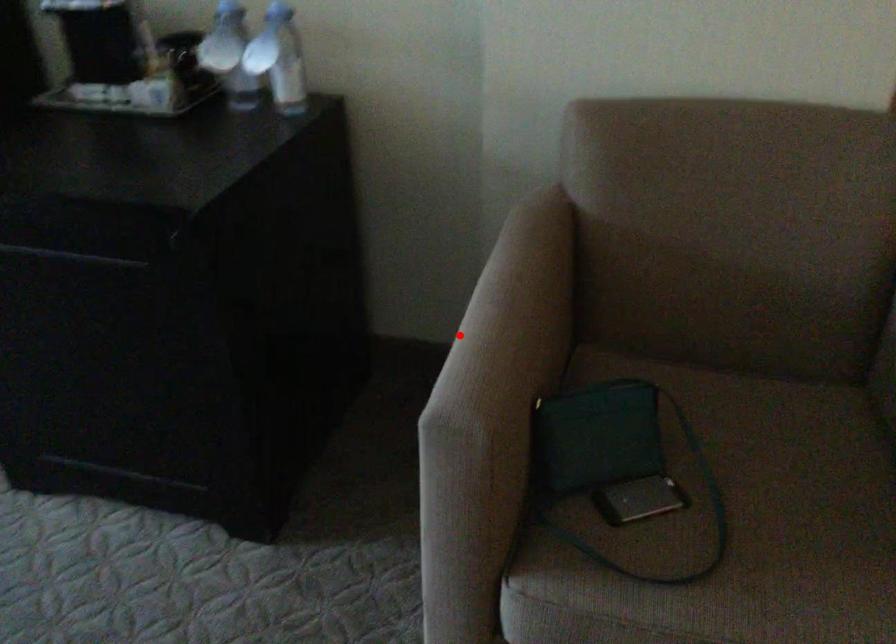
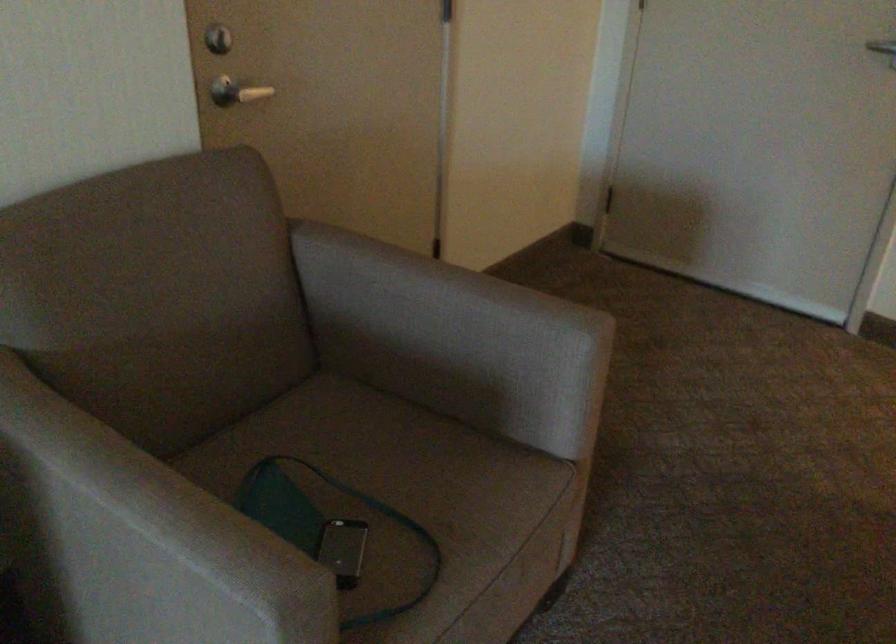
Locate, in the second image, the point that corresponds to the highlighted location in the first image.

(150, 538)